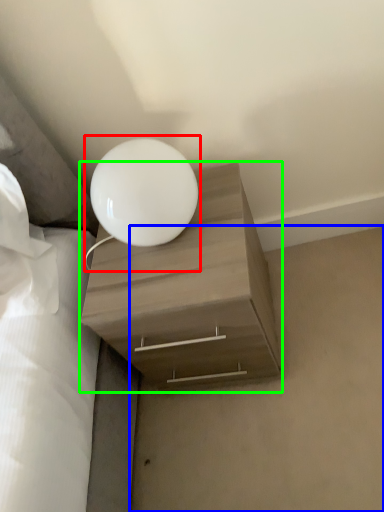
Question: Based on their relative distances, which object is nearer to lamp (highlighted by a red box)? Choose from concrete (highlighted by a blue box) and nightstand (highlighted by a green box).

Choices:
 (A) concrete
 (B) nightstand

Answer: (B)